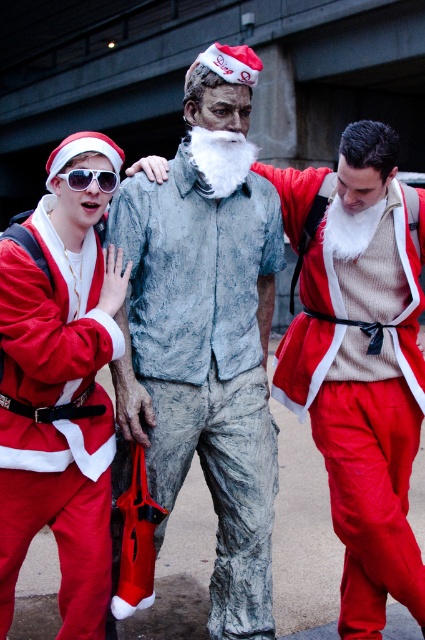
You are a photographer taking a picture of the lively scene with the three individuals. You notice two points marked in the image at coordinates point (297, 362) and point (16, 372). Which point is closer to your camera lens?

Point (297, 362) is further to the camera than point (16, 372), so the point closer to the camera lens is point (16, 372).